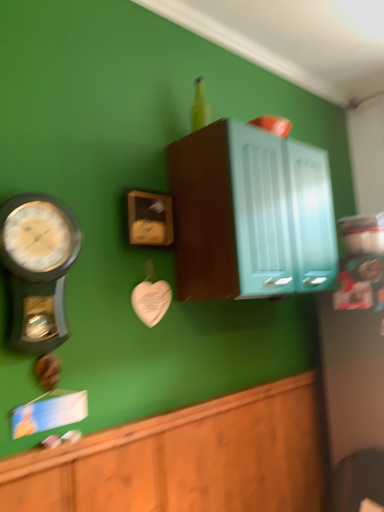
Question: Based on their positions, is teal glossy cabinet at upper center, marked as the 1th cabinetry in a top-to-bottom arrangement, located to the left or right of wooden clock at center?

Choices:
 (A) left
 (B) right

Answer: (B)

Question: Is teal glossy cabinet at upper center, marked as the 2th cabinetry in a bottom-to-top arrangement, wider or thinner than wooden clock at center?

Choices:
 (A) wide
 (B) thin

Answer: (A)

Question: Estimate the real-world distances between objects in this image. Which object is farther from the wooden cabinet at lower center, positioned as the first cabinetry in bottom-to-top order?

Choices:
 (A) wooden clock at center
 (B) metallic silver wall clock at left
 (C) teal glossy cabinet at upper center, marked as the 1th cabinetry in a top-to-bottom arrangement

Answer: (A)

Question: Which object is the closest to the teal glossy cabinet at upper center, marked as the 2th cabinetry in a bottom-to-top arrangement?

Choices:
 (A) metallic silver wall clock at left
 (B) wooden cabinet at lower center, which ranks as the 2th cabinetry in top-to-bottom order
 (C) wooden clock at center

Answer: (C)